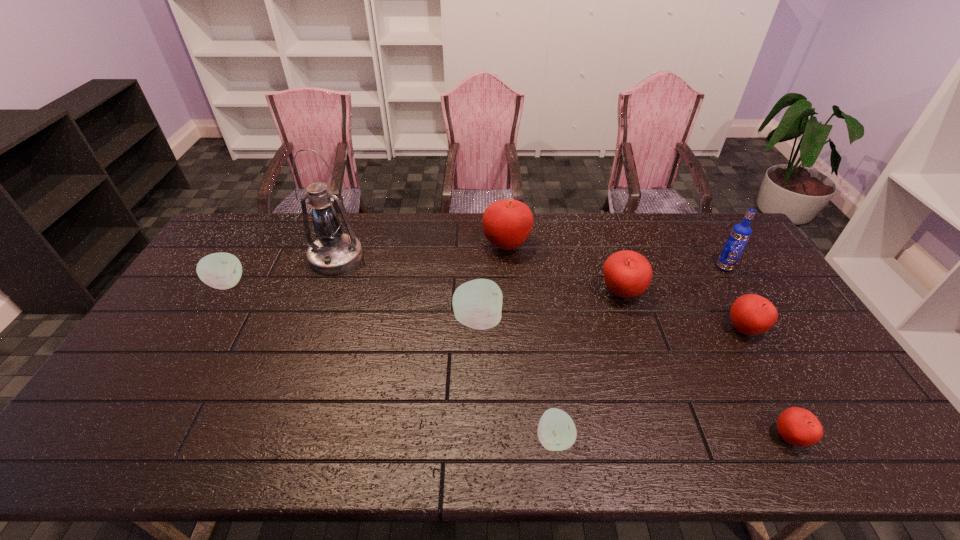
Locate an element on the screen. This screenshot has width=960, height=540. vacant space that satisfies the following two spatial constraints: 1. on the front side of the smallest white apple; 2. on the right side of the second smallest white apple is located at coordinates (133, 438).

What are the coordinates of `vacant space that satisfies the following two spatial constraints: 1. on the front side of the fifth apple from left to right; 2. on the left side of the smallest red apple` in the screenshot? It's located at (668, 437).

Where is `free location that satisfies the following two spatial constraints: 1. on the front side of the leftmost white apple; 2. on the left side of the fourth object from right to left`? free location that satisfies the following two spatial constraints: 1. on the front side of the leftmost white apple; 2. on the left side of the fourth object from right to left is located at coordinates (221, 294).